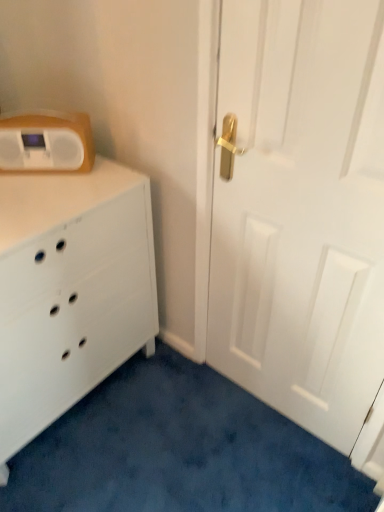
Locate an element on the screen. The image size is (384, 512). empty space that is to the right of matte white radio at upper left is located at coordinates (95, 177).